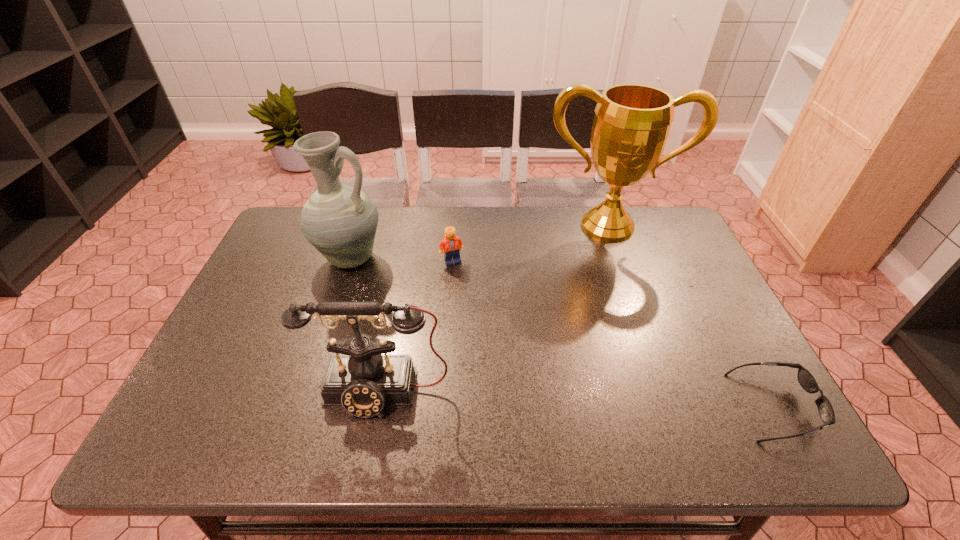
Where is `award at the right edge`? This screenshot has height=540, width=960. award at the right edge is located at coordinates (632, 122).

At what (x,y) coordinates should I click in order to perform the action: click on object at the far left corner. Please return your answer as a coordinate pair (x, y). Looking at the image, I should click on (340, 221).

What are the coordinates of `object located in the far right corner section of the desktop` in the screenshot? It's located at (632, 122).

In order to click on object at the near right corner in this screenshot , I will do `click(805, 378)`.

The image size is (960, 540). Identify the location of free region at the far edge. (385, 221).

Identify the location of free region at the near edge of the desktop. (492, 395).

Locate an element on the screen. Image resolution: width=960 pixels, height=540 pixels. vacant area at the left edge is located at coordinates (275, 265).

In the image, there is a desktop. Where is `vacant space at the right edge`? The width and height of the screenshot is (960, 540). vacant space at the right edge is located at coordinates (700, 318).

In the image, there is a desktop. Identify the location of vacant region at the far right corner. The image size is (960, 540). (631, 208).

What are the coordinates of `vacant region at the near right corner` in the screenshot? It's located at (763, 388).